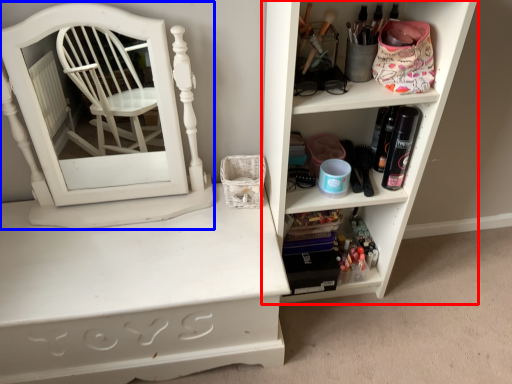
Question: Which point is further to the camera, shelf (highlighted by a red box) or medicine cabinet (highlighted by a blue box)?

Choices:
 (A) shelf
 (B) medicine cabinet

Answer: (B)